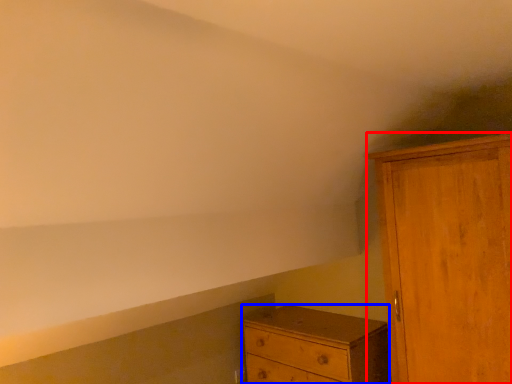
Question: Which object is closer to the camera taking this photo, cupboard (highlighted by a red box) or chest of drawers (highlighted by a blue box)?

Choices:
 (A) cupboard
 (B) chest of drawers

Answer: (A)